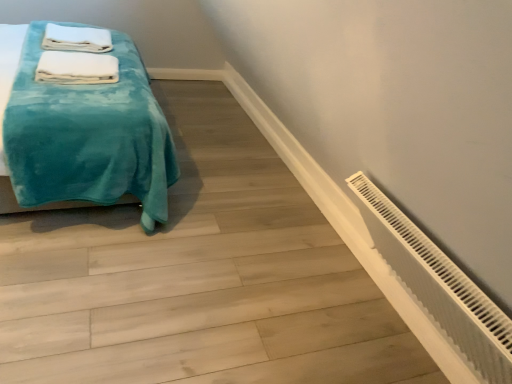
What do you see at coordinates (77, 39) in the screenshot?
I see `white soft towel at upper left, which is the 1th bath towel in back-to-front order` at bounding box center [77, 39].

You are a GUI agent. You are given a task and a screenshot of the screen. Output one action in this format:
    pyautogui.click(x=<x>, y=<y>)
    Task: Click on the white soft towel at upper left, which is the first bath towel in front-to-back order
    
    Given the screenshot: What is the action you would take?
    pyautogui.click(x=76, y=68)

The width and height of the screenshot is (512, 384). I want to click on bed above the white plastic radiator at lower right (from the image's perspective), so click(x=87, y=127).

From the image's perspective, relative to white plastic radiator at lower right, is teal plush blanket at left above or below?

teal plush blanket at left is above white plastic radiator at lower right.

Which object is positioned more to the left, teal plush blanket at left or white plastic radiator at lower right?

From the viewer's perspective, teal plush blanket at left appears more on the left side.

From a real-world perspective, is teal plush blanket at left physically located above or below white plastic radiator at lower right?

teal plush blanket at left is above white plastic radiator at lower right.

Could teal plush blanket at left be considered to be inside white soft towel at upper left, the 2th bath towel from the bottom?

No, white soft towel at upper left, the 2th bath towel from the bottom, does not contain teal plush blanket at left.

Can you confirm if white soft towel at upper left, the 2th bath towel from the bottom, is positioned to the left of teal plush blanket at left?

Correct, you'll find white soft towel at upper left, the 2th bath towel from the bottom, to the left of teal plush blanket at left.

Is white soft towel at upper left, the 2th bath towel from the bottom, oriented away from teal plush blanket at left?

Yes.

Considering the relative positions of white plastic radiator at lower right and white soft towel at upper left, the second bath towel viewed from the back, in the image provided, is white plastic radiator at lower right to the left or to the right of white soft towel at upper left, the second bath towel viewed from the back,?

white plastic radiator at lower right is to the right of white soft towel at upper left, the second bath towel viewed from the back.

Based on the photo, considering the relative sizes of white plastic radiator at lower right and white soft towel at upper left, the first bath towel ordered from the bottom, in the image provided, is white plastic radiator at lower right shorter than white soft towel at upper left, the first bath towel ordered from the bottom,?

Yes, white plastic radiator at lower right is shorter than white soft towel at upper left, the first bath towel ordered from the bottom.

Looking at this image, from a real-world perspective, which is physically below, white plastic radiator at lower right or white soft towel at upper left, the first bath towel ordered from the bottom?

white plastic radiator at lower right, from a real-world perspective.

Is white plastic radiator at lower right turned away from white soft towel at upper left, the second bath towel viewed from the back?

No, white plastic radiator at lower right is not facing the opposite direction of white soft towel at upper left, the second bath towel viewed from the back.

Which is correct: white plastic radiator at lower right is inside white soft towel at upper left, which is the 1th bath towel in back-to-front order, or outside of it?

white plastic radiator at lower right cannot be found inside white soft towel at upper left, which is the 1th bath towel in back-to-front order.

Considering the relative sizes of white plastic radiator at lower right and white soft towel at upper left, which ranks as the first bath towel in top-to-bottom order, in the image provided, is white plastic radiator at lower right smaller than white soft towel at upper left, which ranks as the first bath towel in top-to-bottom order,?

Actually, white plastic radiator at lower right might be larger than white soft towel at upper left, which ranks as the first bath towel in top-to-bottom order.

Which is more distant, [352,254] or [102,40]?

Point [102,40]

Does white plastic radiator at lower right have a lesser width compared to white soft towel at upper left, which is the 1th bath towel in back-to-front order?

In fact, white plastic radiator at lower right might be wider than white soft towel at upper left, which is the 1th bath towel in back-to-front order.

Could you tell me if teal plush blanket at left is facing white soft towel at upper left, positioned as the 2th bath towel in front-to-back order?

Yes, teal plush blanket at left is oriented towards white soft towel at upper left, positioned as the 2th bath towel in front-to-back order.

Which is more to the left, teal plush blanket at left or white soft towel at upper left, which ranks as the first bath towel in top-to-bottom order?

white soft towel at upper left, which ranks as the first bath towel in top-to-bottom order.

Can you see teal plush blanket at left touching white soft towel at upper left, which is the 1th bath towel in back-to-front order?

No, teal plush blanket at left is not next to white soft towel at upper left, which is the 1th bath towel in back-to-front order.

From a real-world perspective, does teal plush blanket at left stand above white soft towel at upper left, which is the 1th bath towel in back-to-front order?

No, from a real-world perspective, teal plush blanket at left is not on top of white soft towel at upper left, which is the 1th bath towel in back-to-front order.

From a real-world perspective, between white soft towel at upper left, the 2th bath towel from the bottom, and white soft towel at upper left, the first bath towel ordered from the bottom, who is vertically lower?

white soft towel at upper left, the first bath towel ordered from the bottom.

Is white soft towel at upper left, which ranks as the first bath towel in top-to-bottom order, positioned beyond the bounds of white soft towel at upper left, which is the first bath towel in front-to-back order?

Indeed, white soft towel at upper left, which ranks as the first bath towel in top-to-bottom order, is completely outside white soft towel at upper left, which is the first bath towel in front-to-back order.

Can you confirm if white soft towel at upper left, positioned as the 2th bath towel in front-to-back order, is wider than white soft towel at upper left, the first bath towel ordered from the bottom?

Indeed, white soft towel at upper left, positioned as the 2th bath towel in front-to-back order, has a greater width compared to white soft towel at upper left, the first bath towel ordered from the bottom.

Would you say white soft towel at upper left, which is the first bath towel in front-to-back order, is part of teal plush blanket at left's contents?

Yes, white soft towel at upper left, which is the first bath towel in front-to-back order, is a part of teal plush blanket at left.

From the picture: Considering the positions of objects teal plush blanket at left and white soft towel at upper left, the 2th bath towel when ordered from top to bottom, in the image provided, who is behind, teal plush blanket at left or white soft towel at upper left, the 2th bath towel when ordered from top to bottom,?

Positioned behind is white soft towel at upper left, the 2th bath towel when ordered from top to bottom.

From the image's perspective, is teal plush blanket at left located beneath white soft towel at upper left, which is the first bath towel in front-to-back order?

No.

Is teal plush blanket at left oriented towards white soft towel at upper left, the first bath towel ordered from the bottom?

Yes, teal plush blanket at left is aimed at white soft towel at upper left, the first bath towel ordered from the bottom.

The image size is (512, 384). I want to click on bed behind the white plastic radiator at lower right, so click(x=87, y=127).

Image resolution: width=512 pixels, height=384 pixels. Find the location of `the 2nd bath towel positioned above the teal plush blanket at left (from a real-world perspective)`. the 2nd bath towel positioned above the teal plush blanket at left (from a real-world perspective) is located at coordinates (77, 39).

Looking at the image, which one is located closer to white soft towel at upper left, which ranks as the first bath towel in top-to-bottom order, white soft towel at upper left, the first bath towel ordered from the bottom, or teal plush blanket at left?

The object closer to white soft towel at upper left, which ranks as the first bath towel in top-to-bottom order, is white soft towel at upper left, the first bath towel ordered from the bottom.

Estimate the real-world distances between objects in this image. Which object is closer to teal plush blanket at left, white soft towel at upper left, positioned as the 2th bath towel in front-to-back order, or white plastic radiator at lower right?

The object closer to teal plush blanket at left is white soft towel at upper left, positioned as the 2th bath towel in front-to-back order.

In the scene shown: Based on their spatial positions, is white soft towel at upper left, which is the 1th bath towel in back-to-front order, or white plastic radiator at lower right closer to white soft towel at upper left, the first bath towel ordered from the bottom?

white soft towel at upper left, which is the 1th bath towel in back-to-front order, is closer to white soft towel at upper left, the first bath towel ordered from the bottom.

Which object lies further to the anchor point white soft towel at upper left, the second bath towel viewed from the back, teal plush blanket at left or white soft towel at upper left, which ranks as the first bath towel in top-to-bottom order?

white soft towel at upper left, which ranks as the first bath towel in top-to-bottom order, is positioned further to the anchor white soft towel at upper left, the second bath towel viewed from the back.

Which object lies further to the anchor point white soft towel at upper left, which ranks as the first bath towel in top-to-bottom order, white plastic radiator at lower right or teal plush blanket at left?

Among the two, white plastic radiator at lower right is located further to white soft towel at upper left, which ranks as the first bath towel in top-to-bottom order.

From the image, which object appears to be nearer to teal plush blanket at left, white plastic radiator at lower right or white soft towel at upper left, positioned as the 2th bath towel in front-to-back order?

Based on the image, white soft towel at upper left, positioned as the 2th bath towel in front-to-back order, appears to be nearer to teal plush blanket at left.

When comparing their distances from white soft towel at upper left, the first bath towel ordered from the bottom, does white plastic radiator at lower right or teal plush blanket at left seem closer?

teal plush blanket at left lies closer to white soft towel at upper left, the first bath towel ordered from the bottom, than the other object.

When comparing their distances from white soft towel at upper left, which is the first bath towel in front-to-back order, does white plastic radiator at lower right or white soft towel at upper left, positioned as the 2th bath towel in front-to-back order, seem further?

white plastic radiator at lower right lies further to white soft towel at upper left, which is the first bath towel in front-to-back order, than the other object.

Locate an element on the screen. The image size is (512, 384). bed located between white plastic radiator at lower right and white soft towel at upper left, the 2th bath towel when ordered from top to bottom, in the depth direction is located at coordinates (87, 127).

Locate an element on the screen. The width and height of the screenshot is (512, 384). bath towel between white plastic radiator at lower right and white soft towel at upper left, the 2th bath towel from the bottom, in the front-back direction is located at coordinates (76, 68).

Where is `bed between white plastic radiator at lower right and white soft towel at upper left, the 2th bath towel from the bottom, from front to back`? bed between white plastic radiator at lower right and white soft towel at upper left, the 2th bath towel from the bottom, from front to back is located at coordinates (87, 127).

At what (x,y) coordinates should I click in order to perform the action: click on bath towel located between teal plush blanket at left and white soft towel at upper left, which ranks as the first bath towel in top-to-bottom order, in the depth direction. Please return your answer as a coordinate pair (x, y). This screenshot has height=384, width=512. Looking at the image, I should click on (76, 68).